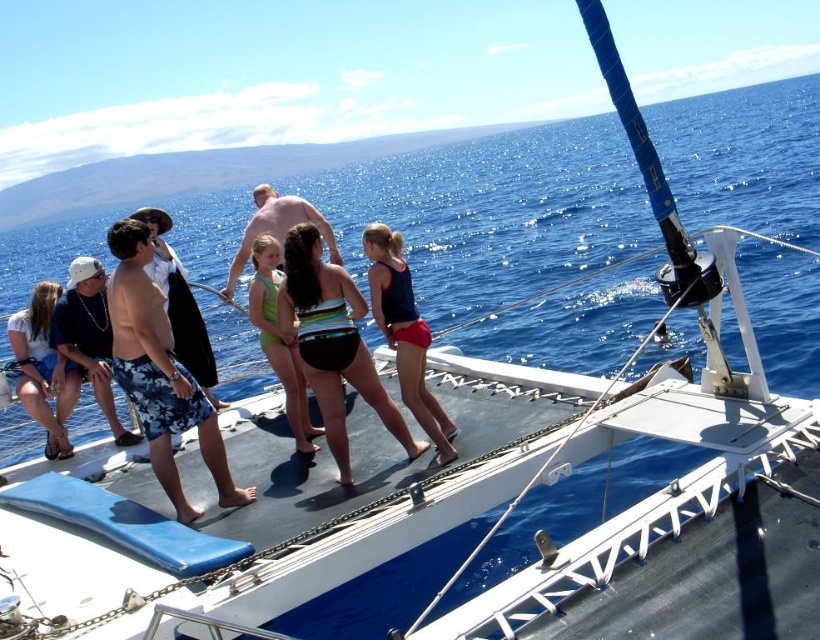
Question: Which object appears closest to the camera in this image?

Choices:
 (A) green swimsuit at center
 (B) multicolored striped swimsuit at center
 (C) camouflage shorts at center
 (D) camouflage shorts at left

Answer: (D)

Question: Does matte blue swimsuit at center appear on the left side of matte black shorts at left?

Choices:
 (A) yes
 (B) no

Answer: (B)

Question: Is multicolored striped swimsuit at center thinner than matte blue swimsuit at center?

Choices:
 (A) no
 (B) yes

Answer: (A)

Question: Which point is closer to the camera?

Choices:
 (A) dark blue shirt at center
 (B) multicolored striped swimsuit at center
 (C) green swimsuit at center
 (D) camouflage shorts at center

Answer: (B)

Question: Which object is the closest to the camouflage shorts at left?

Choices:
 (A) green swimsuit at center
 (B) dark blue shirt at center
 (C) matte blue swimsuit at center
 (D) multicolored striped swimsuit at center

Answer: (D)

Question: Does matte black shorts at left appear on the right side of camouflage shorts at center?

Choices:
 (A) yes
 (B) no

Answer: (B)